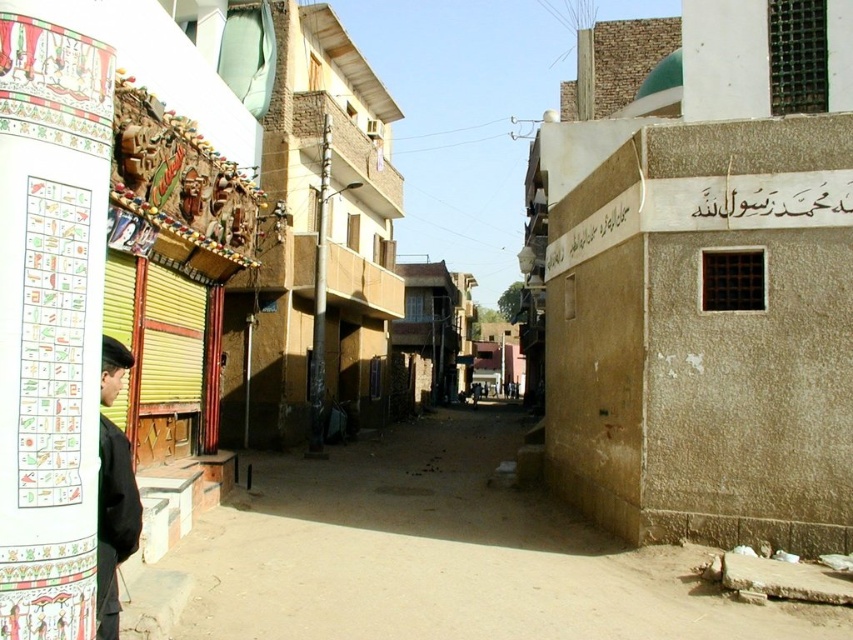
Does dull concrete alley at center have a greater height compared to black stone sign at upper right?

Yes.

In order to click on dull concrete alley at center in this screenshot , I will do `click(434, 556)`.

Is black matte jacket at left positioned at the back of white stone sign at upper right?

No.

Which is below, black matte jacket at left or white stone sign at upper right?

black matte jacket at left

Find the location of a particular element. The image size is (853, 640). black matte jacket at left is located at coordinates (113, 522).

Locate an element on the screen. The height and width of the screenshot is (640, 853). black matte jacket at left is located at coordinates (113, 522).

Is dull concrete alley at center bigger than black matte jacket at left?

Yes, dull concrete alley at center is bigger than black matte jacket at left.

Does dull concrete alley at center appear over black matte jacket at left?

Actually, dull concrete alley at center is below black matte jacket at left.

Does point (403, 518) lie behind point (138, 525)?

Yes, point (403, 518) is farther from viewer.

Where is `dull concrete alley at center`? dull concrete alley at center is located at coordinates (434, 556).